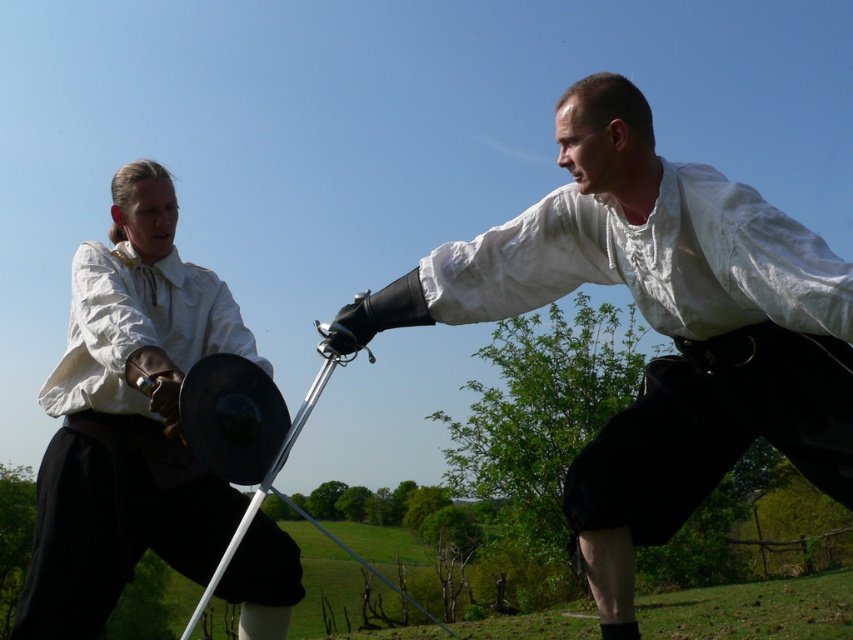
Does point (693, 435) come in front of point (251, 374)?

Yes, point (693, 435) is closer to viewer.

Between point (549, 250) and point (212, 362), which one is positioned in front?

Point (212, 362) is more forward.

In order to click on white matte shirt at upper right in this screenshot , I will do click(x=660, y=326).

Is white matte shirt at upper right taller than matte white shirt at center?

In fact, white matte shirt at upper right may be shorter than matte white shirt at center.

Based on the photo, is white matte shirt at upper right above matte white shirt at center?

Yes.

You are a GUI agent. You are given a task and a screenshot of the screen. Output one action in this format:
    pyautogui.click(x=<x>, y=<y>)
    Task: Click on the white matte shirt at upper right
    The image size is (853, 640).
    Given the screenshot: What is the action you would take?
    pyautogui.click(x=660, y=326)

Can you confirm if matte white shirt at center is wider than black metal pole at center?

Correct, the width of matte white shirt at center exceeds that of black metal pole at center.

The height and width of the screenshot is (640, 853). What are the coordinates of `matte white shirt at center` in the screenshot? It's located at (128, 419).